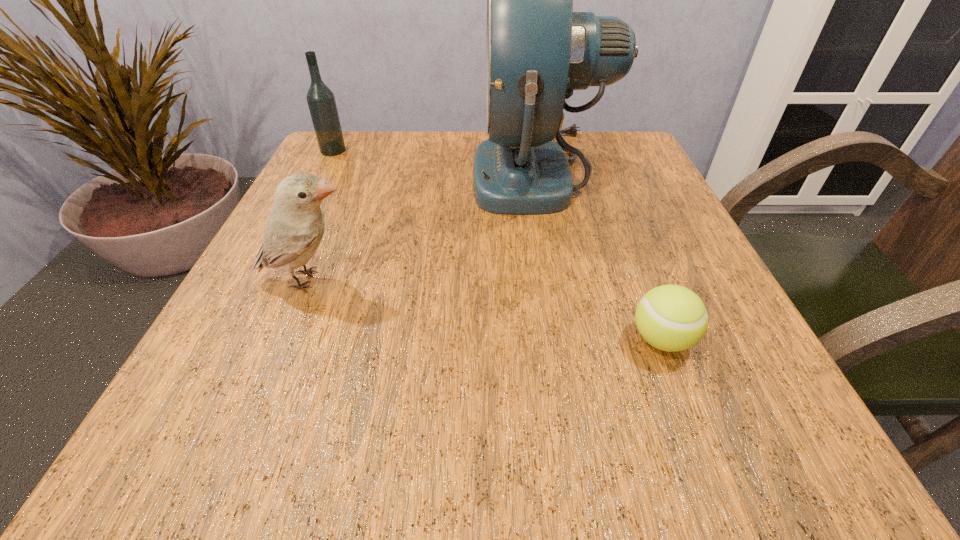
This screenshot has height=540, width=960. I want to click on blank region between the vodka and the fan, so click(x=437, y=162).

I want to click on vacant area that lies between the tennis ball and the second nearest object, so click(x=485, y=310).

Find the location of a particular element. vacant space in between the second nearest object and the fan is located at coordinates (424, 227).

Where is `free area in between the tennis ball and the tallest object`? Image resolution: width=960 pixels, height=540 pixels. free area in between the tennis ball and the tallest object is located at coordinates (601, 256).

Locate an element on the screen. The image size is (960, 540). object that stands as the second closest to the bird is located at coordinates (321, 101).

Locate which object ranks in proximity to the bird. Please provide its 2D coordinates. Your answer should be formatted as a tuple, i.e. [(x, y)], where the tuple contains the x and y coordinates of a point satisfying the conditions above.

[(538, 50)]

Locate an element on the screen. The height and width of the screenshot is (540, 960). vacant region that satisfies the following two spatial constraints: 1. at the face of the nearest object; 2. on the left side of the second nearest object is located at coordinates (284, 340).

This screenshot has height=540, width=960. What are the coordinates of `vacant space that satisfies the following two spatial constraints: 1. at the face of the nearest object; 2. on the left side of the second nearest object` in the screenshot? It's located at (284, 340).

Where is `vacant space that satisfies the following two spatial constraints: 1. at the face of the third farthest object; 2. on the right side of the shortest object`? vacant space that satisfies the following two spatial constraints: 1. at the face of the third farthest object; 2. on the right side of the shortest object is located at coordinates (284, 340).

Identify the location of free location that satisfies the following two spatial constraints: 1. at the face of the bird; 2. on the left side of the shortest object. This screenshot has width=960, height=540. (284, 340).